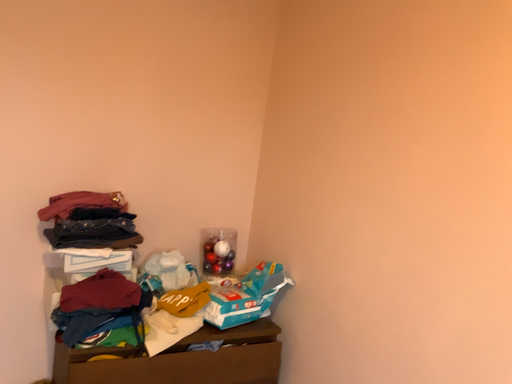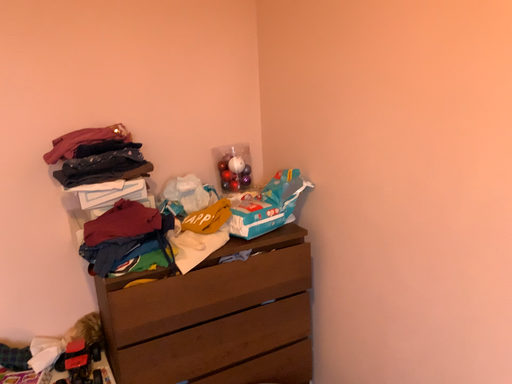
Question: Which way did the camera rotate in the video?

Choices:
 (A) rotated downward
 (B) rotated upward

Answer: (A)